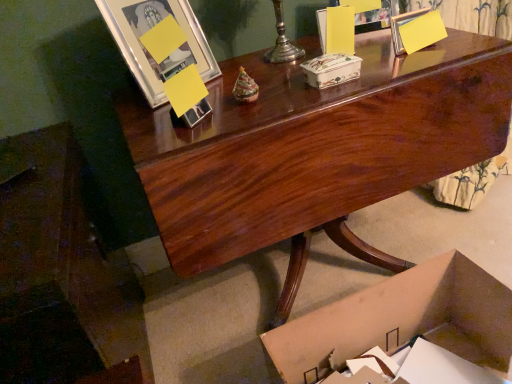
Locate an element on the screen. The width and height of the screenshot is (512, 384). free space in front of metallic silver picture frame at upper left, positioned as the first picture frame in front-to-back order is located at coordinates (170, 115).